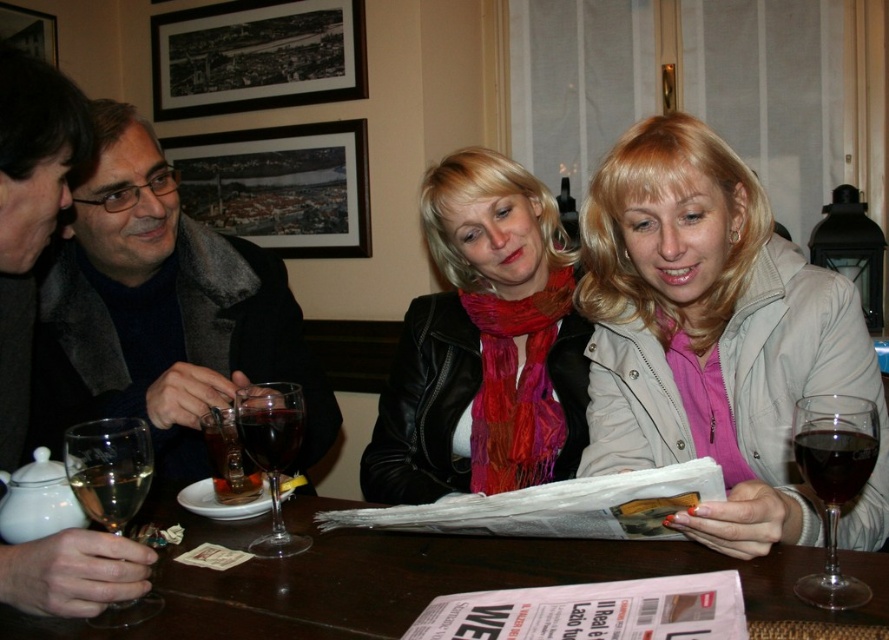
Question: Considering the real-world distances, which object is closest to the light beige jacket at right?

Choices:
 (A) dark red glass at center
 (B) translucent glass wine at center
 (C) clear glass wine glass at lower left

Answer: (A)

Question: Which point is closer to the camera taking this photo?

Choices:
 (A) (815, 428)
 (B) (41, 429)
 (C) (451, 570)
 (D) (654, 234)

Answer: (A)

Question: Which object appears closest to the camera in this image?

Choices:
 (A) light beige jacket at right
 (B) leather jacket at center
 (C) transparent glass wine glass at lower right
 (D) transparent glass at center

Answer: (C)

Question: Is leather jacket at center above dark red glass at center?

Choices:
 (A) yes
 (B) no

Answer: (A)

Question: From the image, what is the correct spatial relationship of brown wooden table at center in relation to translucent glass wine at center?

Choices:
 (A) left
 (B) right

Answer: (B)

Question: In this image, where is clear glass wine glass at lower left located relative to dark red glass at center?

Choices:
 (A) above
 (B) below

Answer: (B)